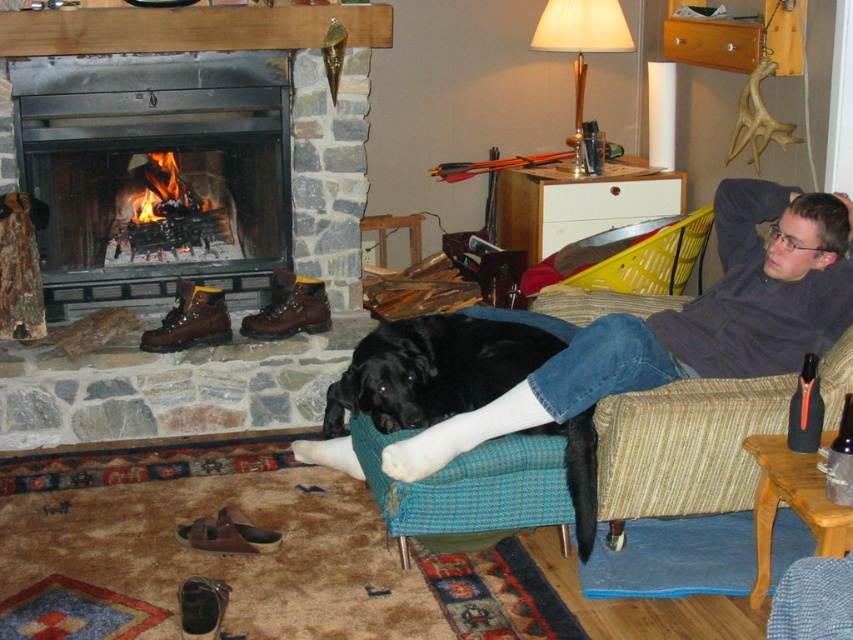
Question: Which point is farther from the camera taking this photo?

Choices:
 (A) (213, 221)
 (B) (817, 388)

Answer: (A)

Question: Can you confirm if black soft fur at lower center is positioned above black matte bottle at right?

Choices:
 (A) yes
 (B) no

Answer: (A)

Question: Among these points, which one is nearest to the camera?

Choices:
 (A) (198, 113)
 (B) (424, 417)
 (C) (811, 435)

Answer: (C)

Question: Among these objects, which one is nearest to the camera?

Choices:
 (A) smooth stone fireplace at center
 (B) black soft fur at lower center

Answer: (B)

Question: Is smooth stone fireplace at center above black soft fur at lower center?

Choices:
 (A) no
 (B) yes

Answer: (B)

Question: Is black soft fur at lower center further to camera compared to black matte bottle at right?

Choices:
 (A) no
 (B) yes

Answer: (B)